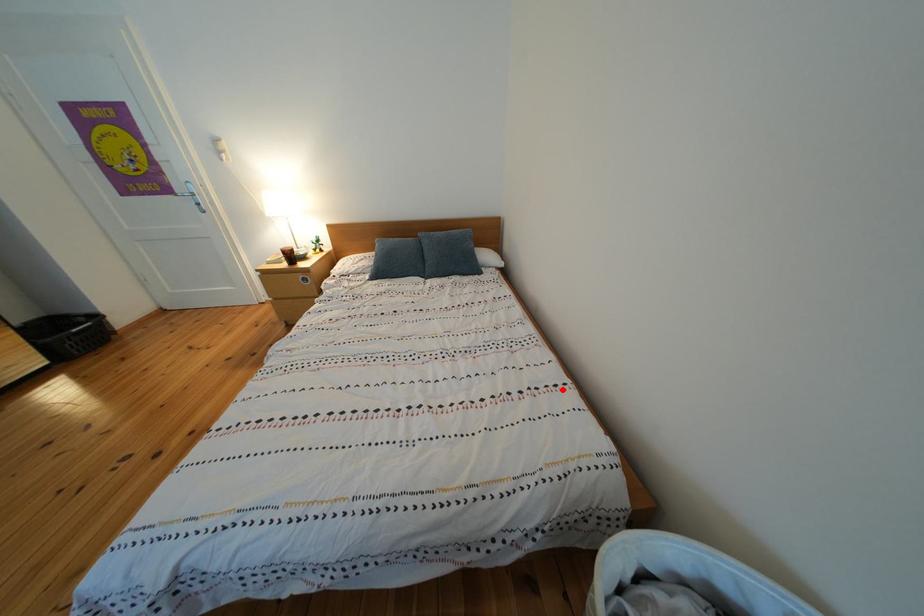
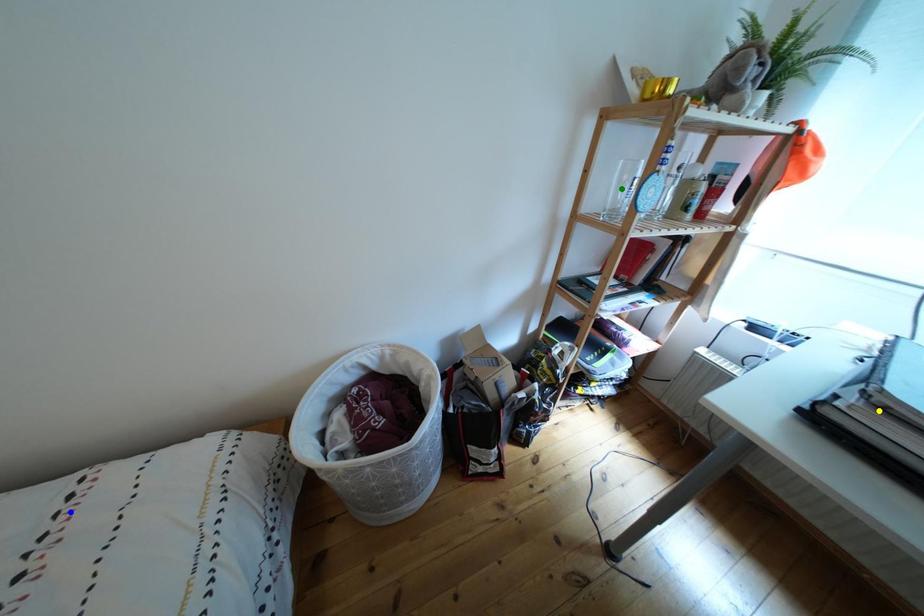
Question: I am providing you with two images of the same scene from different viewpoints. A red point is marked on the first image. You are given multiple points on the second image. Which point in image 2 is actually the same real-world point as the red point in image 1?

Choices:
 (A) blue point
 (B) green point
 (C) yellow point

Answer: (A)